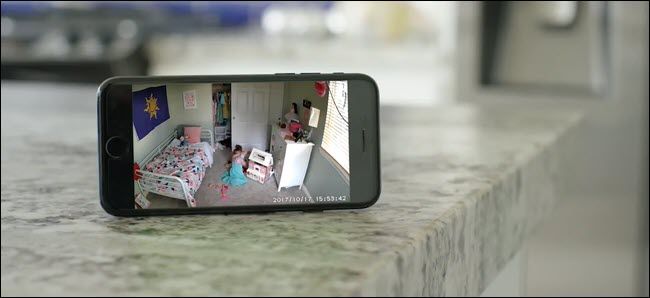
Identify the location of kids bed. (187, 151).